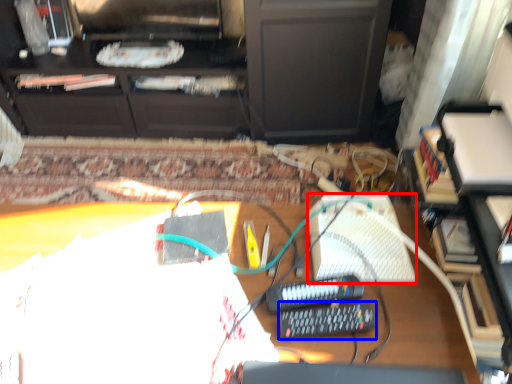
Question: Which point is closer to the camera, keyboard (highlighted by a red box) or equipment (highlighted by a blue box)?

Choices:
 (A) keyboard
 (B) equipment

Answer: (B)